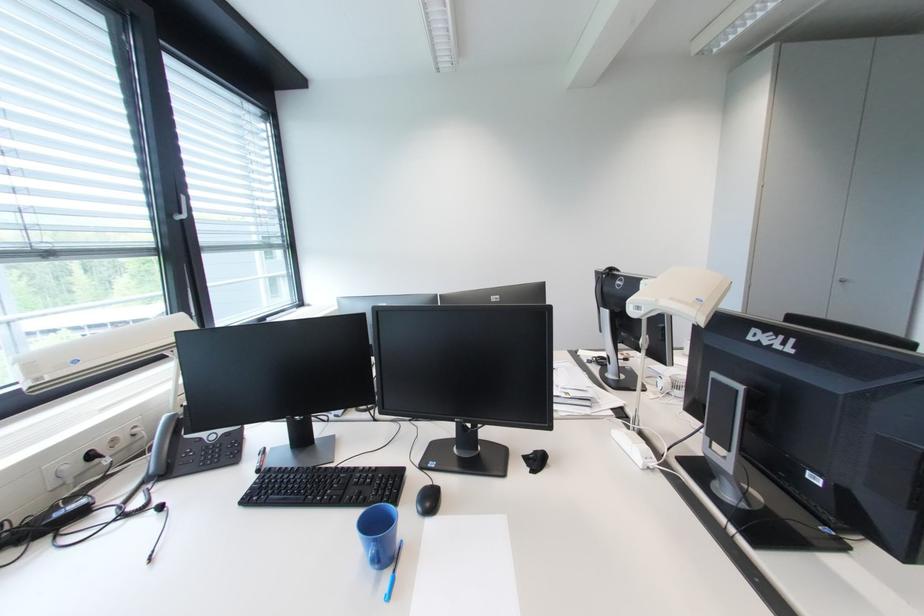
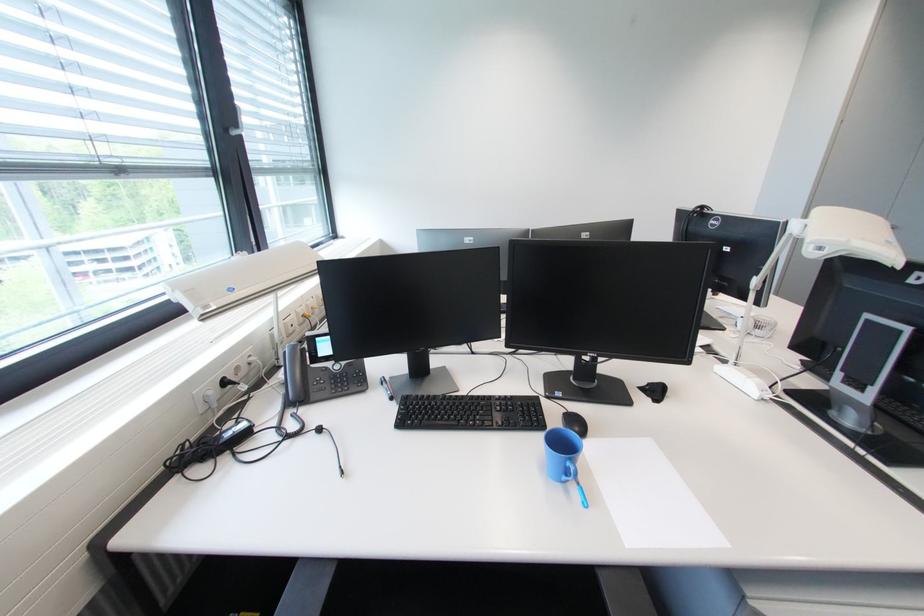
In the second image, find the point that corresponds to (541,454) in the first image.

(655, 386)